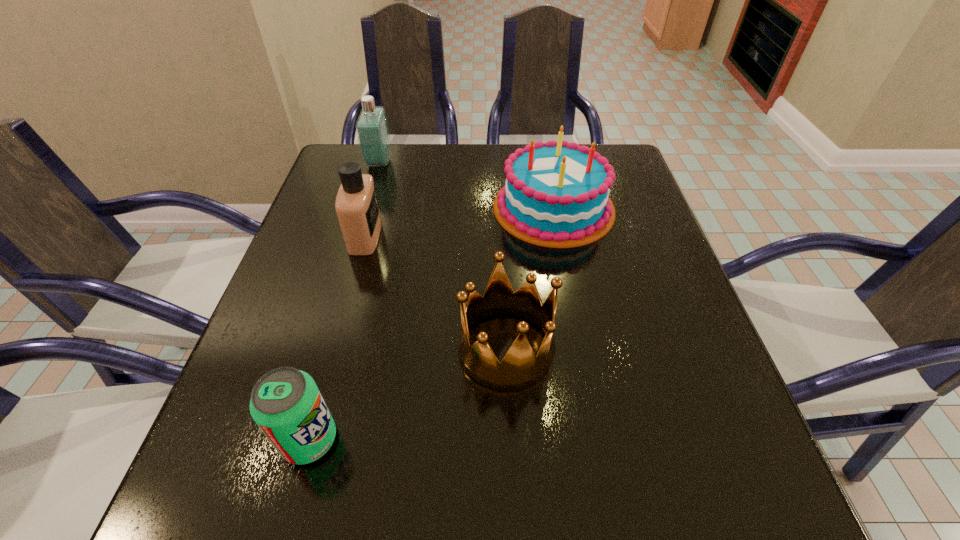
Find the location of `free area in between the second nearest object and the nearest object`. free area in between the second nearest object and the nearest object is located at coordinates (408, 394).

This screenshot has width=960, height=540. I want to click on object that is the fourth closest to the birthday cake, so click(286, 404).

Point out which object is positioned as the nearest to the second nearest object. Please provide its 2D coordinates. Your answer should be formatted as a tuple, i.e. [(x, y)], where the tuple contains the x and y coordinates of a point satisfying the conditions above.

[(556, 193)]

Image resolution: width=960 pixels, height=540 pixels. I want to click on blank area in the image that satisfies the following two spatial constraints: 1. on the front label of the birthday cake; 2. on the right side of the farther perfume, so click(366, 208).

Locate an element on the screen. This screenshot has width=960, height=540. vacant space that satisfies the following two spatial constraints: 1. on the front label of the fourth farthest object; 2. on the left side of the nearer perfume is located at coordinates (334, 348).

I want to click on free space that satisfies the following two spatial constraints: 1. on the front label of the second nearest object; 2. on the left side of the farthest object, so click(x=324, y=348).

Where is `free space that satisfies the following two spatial constraints: 1. on the back side of the second nearest object; 2. on the front label of the nearer perfume`? Image resolution: width=960 pixels, height=540 pixels. free space that satisfies the following two spatial constraints: 1. on the back side of the second nearest object; 2. on the front label of the nearer perfume is located at coordinates (500, 236).

Identify the location of free spot that satisfies the following two spatial constraints: 1. on the back side of the birthday cake; 2. on the front label of the farthest object. (545, 163).

Where is `vacant space that satisfies the following two spatial constraints: 1. on the front label of the farthest object; 2. on the left side of the birthday cake`? vacant space that satisfies the following two spatial constraints: 1. on the front label of the farthest object; 2. on the left side of the birthday cake is located at coordinates (366, 208).

Where is `vacant area in the image that satisfies the following two spatial constraints: 1. on the front label of the nearer perfume; 2. on the back side of the fourth farthest object`? This screenshot has width=960, height=540. vacant area in the image that satisfies the following two spatial constraints: 1. on the front label of the nearer perfume; 2. on the back side of the fourth farthest object is located at coordinates (334, 348).